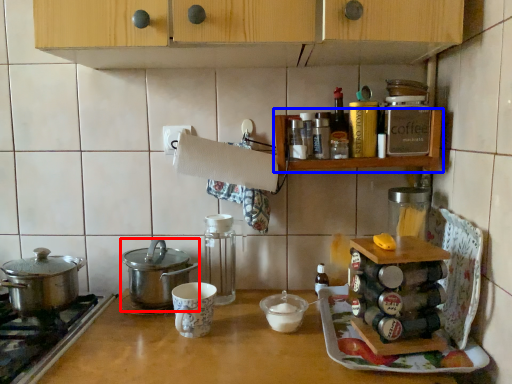
Question: Which of the following is the farthest to the observer, kitchen appliance (highlighted by a red box) or shelf (highlighted by a blue box)?

Choices:
 (A) kitchen appliance
 (B) shelf

Answer: (A)